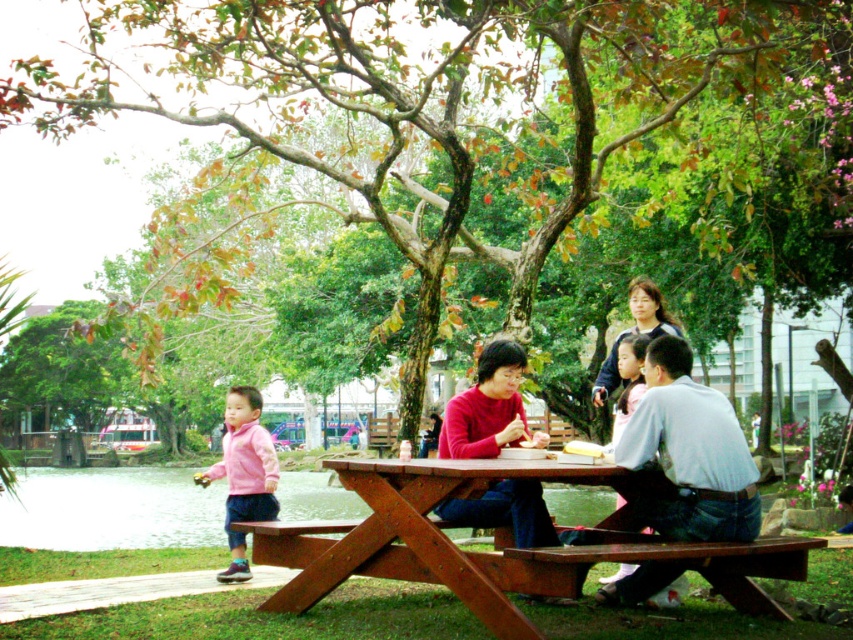
Between wooden picnic table at center and matte red sweater at center, which one has less height?

With less height is matte red sweater at center.

Can you confirm if wooden picnic table at center is smaller than matte red sweater at center?

Incorrect, wooden picnic table at center is not smaller in size than matte red sweater at center.

Which is in front, point (628, 576) or point (463, 412)?

Point (628, 576)

Where is `wooden picnic table at center`? Image resolution: width=853 pixels, height=640 pixels. wooden picnic table at center is located at coordinates (701, 493).

Between matte red sweater at center and brown wooden bench at lower center, which one is positioned lower?

Positioned lower is brown wooden bench at lower center.

Can you confirm if matte red sweater at center is bigger than brown wooden bench at lower center?

Correct, matte red sweater at center is larger in size than brown wooden bench at lower center.

Between point (457, 420) and point (753, 600), which one is positioned in front?

Point (753, 600) is more forward.

The height and width of the screenshot is (640, 853). In order to click on matte red sweater at center in this screenshot , I will do `click(488, 406)`.

Which of these two, matte red sweater at center or pink fleece jacket at lower left, stands shorter?

matte red sweater at center

Between matte red sweater at center and pink fleece jacket at lower left, which one has more height?

With more height is pink fleece jacket at lower left.

Find the location of `matte red sweater at center`. matte red sweater at center is located at coordinates (488, 406).